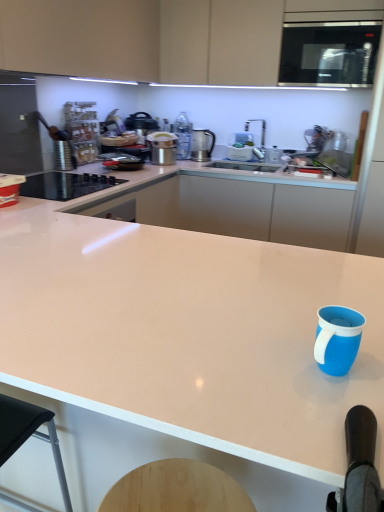
Question: Would you say metallic silver pot at upper center, which ranks as the 2th kitchen appliance in back-to-front order, is to the left or to the right of white glossy countertop at center, the first countertop positioned from the back, in the picture?

Choices:
 (A) left
 (B) right

Answer: (A)

Question: Is point (152, 150) positioned closer to the camera than point (336, 234)?

Choices:
 (A) closer
 (B) farther

Answer: (B)

Question: Which of these objects is positioned closest to the satin silver kettle at upper center, marked as the 1th kitchen appliance in a right-to-left arrangement?

Choices:
 (A) metallic silver pot at upper center, the 1th kitchen appliance positioned from the front
 (B) blue matte mug at lower right
 (C) black glass cooktop at left
 (D) white glossy countertop at center, acting as the 2th countertop starting from the back
 (E) satin black microwave at upper right

Answer: (A)

Question: Which object is the farthest from the black glass cooktop at left?

Choices:
 (A) white glossy countertop at center, acting as the 2th countertop starting from the back
 (B) satin silver kettle at upper center, marked as the 2th kitchen appliance in a left-to-right arrangement
 (C) blue matte mug at lower right
 (D) satin black microwave at upper right
 (E) metallic silver pot at upper center, which ranks as the 2th kitchen appliance in back-to-front order

Answer: (C)